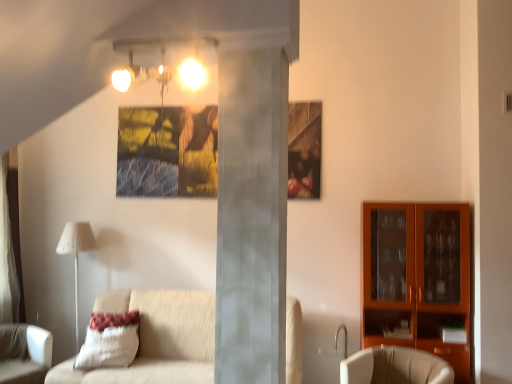
Locate an element on the screen. white textured pillow at lower left is located at coordinates (110, 341).

Where is `matte orange cabinet at right`? matte orange cabinet at right is located at coordinates point(418,278).

Image resolution: width=512 pixels, height=384 pixels. Describe the element at coordinates (76, 255) in the screenshot. I see `white fabric lampshade at left` at that location.

The height and width of the screenshot is (384, 512). What do you see at coordinates (24, 354) in the screenshot? I see `white fabric chair at lower left, arranged as the first chair when viewed from the left` at bounding box center [24, 354].

Find the location of a particular element. This screenshot has height=384, width=512. white textured pillow at lower left is located at coordinates (110, 341).

Which is behind, point (442, 374) or point (8, 196)?

The point (8, 196) is farther from the camera.

Where is `curtain located above the beige fabric chair at lower right, which appears as the 1th chair when viewed from the right (from a real-world perspective)`? The height and width of the screenshot is (384, 512). curtain located above the beige fabric chair at lower right, which appears as the 1th chair when viewed from the right (from a real-world perspective) is located at coordinates coord(7,256).

From the image's perspective, which is above, beige fabric chair at lower right, which appears as the 2th chair when viewed from the left, or white fabric curtain at left?

white fabric curtain at left is shown above in the image.

Is beige fabric chair at lower right, which appears as the 1th chair when viewed from the right, positioned far away from white fabric curtain at left?

Yes, beige fabric chair at lower right, which appears as the 1th chair when viewed from the right, and white fabric curtain at left are quite far apart.

Is matte glass light fixture at upper center smaller than white fabric lampshade at left?

Correct, matte glass light fixture at upper center occupies less space than white fabric lampshade at left.

Based on the photo, is matte glass light fixture at upper center to the right of white fabric lampshade at left from the viewer's perspective?

Yes.

Which of these two, matte glass light fixture at upper center or white fabric lampshade at left, is wider?

Wider between the two is white fabric lampshade at left.

Which object is further away from the camera taking this photo, matte glass light fixture at upper center or white fabric lampshade at left?

white fabric lampshade at left.

From the image's perspective, would you say beige fabric chair at lower right, which appears as the 1th chair when viewed from the right, is positioned over white textured pillow at lower left?

No, from the image's perspective, beige fabric chair at lower right, which appears as the 1th chair when viewed from the right, is not over white textured pillow at lower left.

Which chair is the 2nd one when counting from the front of the white textured pillow at lower left? Please provide its 2D coordinates.

[(395, 367)]

How distant is white fabric lampshade at left from white fabric chair at lower left, arranged as the first chair when viewed from the left?

white fabric lampshade at left is 66.11 centimeters from white fabric chair at lower left, arranged as the first chair when viewed from the left.

Is white fabric lampshade at left touching white fabric chair at lower left, arranged as the 2th chair when viewed from the right?

No.

Who is smaller, white fabric lampshade at left or white fabric chair at lower left, arranged as the first chair when viewed from the left?

With smaller size is white fabric lampshade at left.

Visually, is white fabric lampshade at left positioned to the left or to the right of white fabric chair at lower left, arranged as the first chair when viewed from the left?

white fabric lampshade at left is to the right of white fabric chair at lower left, arranged as the first chair when viewed from the left.

Is white textured pillow at lower left behind beige fabric chair at lower right, which appears as the 2th chair when viewed from the left?

Yes, white textured pillow at lower left is behind beige fabric chair at lower right, which appears as the 2th chair when viewed from the left.

From a real-world perspective, is white textured pillow at lower left over beige fabric chair at lower right, which appears as the 2th chair when viewed from the left?

Yes.

Is white textured pillow at lower left taller or shorter than beige fabric chair at lower right, which appears as the 1th chair when viewed from the right?

In the image, white textured pillow at lower left appears to be taller than beige fabric chair at lower right, which appears as the 1th chair when viewed from the right.

Is beige fabric chair at lower right, which appears as the 2th chair when viewed from the left, inside white textured pillow at lower left?

Definitely not — beige fabric chair at lower right, which appears as the 2th chair when viewed from the left, is not inside white textured pillow at lower left.

Between white fabric chair at lower left, arranged as the 2th chair when viewed from the right, and white fabric lampshade at left, which one has more height?

white fabric lampshade at left is taller.

Which object is further away from the camera taking this photo, white fabric chair at lower left, arranged as the 2th chair when viewed from the right, or white fabric lampshade at left?

white fabric lampshade at left is more distant.

Between white fabric chair at lower left, arranged as the first chair when viewed from the left, and white fabric lampshade at left, which one appears on the left side from the viewer's perspective?

white fabric chair at lower left, arranged as the first chair when viewed from the left, is more to the left.

Based on the photo, is white fabric chair at lower left, arranged as the first chair when viewed from the left, bigger or smaller than white fabric lampshade at left?

Considering their sizes, white fabric chair at lower left, arranged as the first chair when viewed from the left, takes up more space than white fabric lampshade at left.

Is beige fabric chair at lower right, which appears as the 1th chair when viewed from the right, wider than white fabric chair at lower left, arranged as the first chair when viewed from the left?

No.

Does beige fabric chair at lower right, which appears as the 2th chair when viewed from the left, have a lesser height compared to white fabric chair at lower left, arranged as the 2th chair when viewed from the right?

Indeed, beige fabric chair at lower right, which appears as the 2th chair when viewed from the left, has a lesser height compared to white fabric chair at lower left, arranged as the 2th chair when viewed from the right.

Can you tell me how much beige fabric chair at lower right, which appears as the 2th chair when viewed from the left, and white fabric chair at lower left, arranged as the first chair when viewed from the left, differ in facing direction?

There is a 90-degree angle between the facing directions of beige fabric chair at lower right, which appears as the 2th chair when viewed from the left, and white fabric chair at lower left, arranged as the first chair when viewed from the left.

From a real-world perspective, is beige fabric chair at lower right, which appears as the 1th chair when viewed from the right, positioned above or below white fabric chair at lower left, arranged as the first chair when viewed from the left?

In terms of real-world spatial position, beige fabric chair at lower right, which appears as the 1th chair when viewed from the right, is above white fabric chair at lower left, arranged as the first chair when viewed from the left.

Where is `curtain above the beige fabric chair at lower right, which appears as the 1th chair when viewed from the right (from the image's perspective)`? The width and height of the screenshot is (512, 384). curtain above the beige fabric chair at lower right, which appears as the 1th chair when viewed from the right (from the image's perspective) is located at coordinates (7, 256).

Image resolution: width=512 pixels, height=384 pixels. I want to click on table lamp behind the matte glass light fixture at upper center, so click(76, 255).

Considering their positions, is matte orange cabinet at right positioned closer to beige fabric chair at lower right, which appears as the 1th chair when viewed from the right, than matte glass light fixture at upper center?

matte orange cabinet at right.

Considering their positions, is white fabric lampshade at left positioned further to white fabric chair at lower left, arranged as the 2th chair when viewed from the right, than matte orange cabinet at right?

matte orange cabinet at right lies further to white fabric chair at lower left, arranged as the 2th chair when viewed from the right, than the other object.

Estimate the real-world distances between objects in this image. Which object is further from matte orange cabinet at right, white fabric chair at lower left, arranged as the 2th chair when viewed from the right, or white textured pillow at lower left?

The object further to matte orange cabinet at right is white fabric chair at lower left, arranged as the 2th chair when viewed from the right.

Which object lies further to the anchor point beige fabric chair at lower right, which appears as the 2th chair when viewed from the left, white fabric chair at lower left, arranged as the 2th chair when viewed from the right, or white textured pillow at lower left?

Among the two, white fabric chair at lower left, arranged as the 2th chair when viewed from the right, is located further to beige fabric chair at lower right, which appears as the 2th chair when viewed from the left.

Estimate the real-world distances between objects in this image. Which object is further from white textured pillow at lower left, white fabric chair at lower left, arranged as the 2th chair when viewed from the right, or matte orange cabinet at right?

Among the two, matte orange cabinet at right is located further to white textured pillow at lower left.

From the image, which object appears to be nearer to white fabric chair at lower left, arranged as the 2th chair when viewed from the right, white textured pillow at lower left or white fabric curtain at left?

The object closer to white fabric chair at lower left, arranged as the 2th chair when viewed from the right, is white textured pillow at lower left.

Based on their spatial positions, is white fabric chair at lower left, arranged as the 2th chair when viewed from the right, or beige fabric couch at left further from matte orange cabinet at right?

The object further to matte orange cabinet at right is white fabric chair at lower left, arranged as the 2th chair when viewed from the right.

Estimate the real-world distances between objects in this image. Which object is further from matte orange cabinet at right, white textured pillow at lower left or white fabric curtain at left?

Based on the image, white fabric curtain at left appears to be further to matte orange cabinet at right.

Locate an element on the screen. studio couch positioned between matte glass light fixture at upper center and white fabric curtain at left from near to far is located at coordinates (157, 339).

Locate an element on the screen. Image resolution: width=512 pixels, height=384 pixels. studio couch between matte glass light fixture at upper center and beige fabric chair at lower right, which appears as the 1th chair when viewed from the right, in the up-down direction is located at coordinates (157, 339).

Locate an element on the screen. This screenshot has height=384, width=512. pillow located between white fabric chair at lower left, arranged as the first chair when viewed from the left, and beige fabric chair at lower right, which appears as the 1th chair when viewed from the right, in the left-right direction is located at coordinates (110, 341).

Identify the location of table lamp between white fabric chair at lower left, arranged as the first chair when viewed from the left, and matte orange cabinet at right from left to right. The height and width of the screenshot is (384, 512). (76, 255).